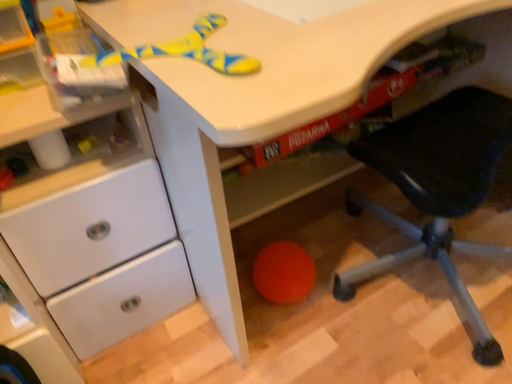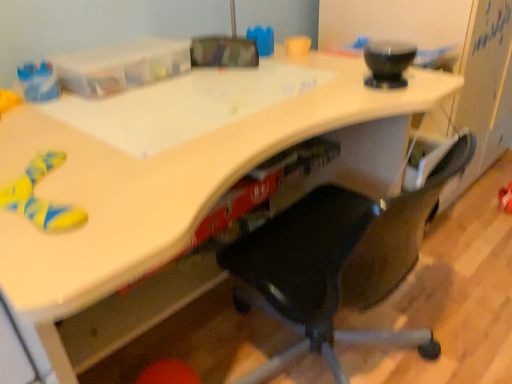
Question: Which way did the camera rotate in the video?

Choices:
 (A) rotated left
 (B) rotated right

Answer: (B)